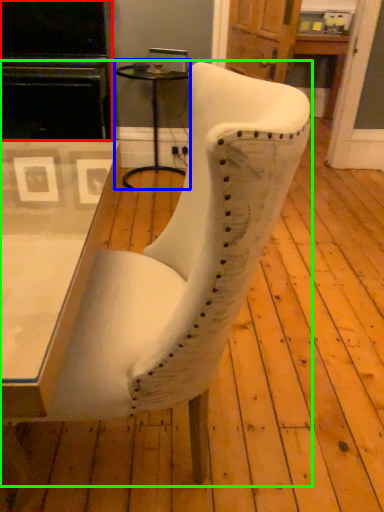
Question: Which object is positioned farthest from entertainment center (highlighted by a red box)? Select from side table (highlighted by a blue box) and chair (highlighted by a green box).

Choices:
 (A) side table
 (B) chair

Answer: (B)